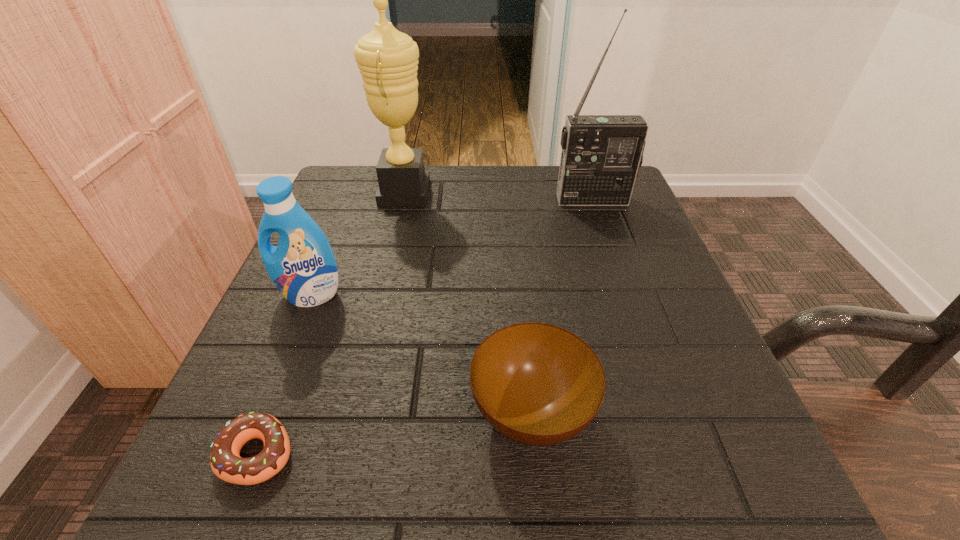
Locate an element on the screen. This screenshot has height=540, width=960. object that is the fourth closest to the trophy cup is located at coordinates (226, 463).

Find the location of a particular element. This screenshot has width=960, height=540. object that is the third closest to the radio receiver is located at coordinates (302, 266).

The width and height of the screenshot is (960, 540). What are the coordinates of `free spot that satisfies the following two spatial constraints: 1. on the back side of the fourth object from left to right; 2. at the front of the trophy cup with handles` in the screenshot? It's located at (510, 192).

Identify the location of vacant space that satisfies the following two spatial constraints: 1. at the front of the trophy cup with handles; 2. on the front-facing side of the detergent. The width and height of the screenshot is (960, 540). tap(380, 295).

The image size is (960, 540). In order to click on vacant space that satisfies the following two spatial constraints: 1. on the front-facing side of the shortest object; 2. on the left side of the detergent in this screenshot , I will do `click(247, 453)`.

Locate an element on the screen. blank space that satisfies the following two spatial constraints: 1. at the front of the fourth object from left to right with handles; 2. on the right side of the trophy cup is located at coordinates (351, 414).

Where is `vacant position in the image that satisfies the following two spatial constraints: 1. on the front-facing side of the second object from right to left; 2. on the left side of the detergent`? Image resolution: width=960 pixels, height=540 pixels. vacant position in the image that satisfies the following two spatial constraints: 1. on the front-facing side of the second object from right to left; 2. on the left side of the detergent is located at coordinates (263, 414).

Where is `free location that satisfies the following two spatial constraints: 1. at the front of the second shortest object with handles; 2. on the left side of the trophy cup`? free location that satisfies the following two spatial constraints: 1. at the front of the second shortest object with handles; 2. on the left side of the trophy cup is located at coordinates (351, 414).